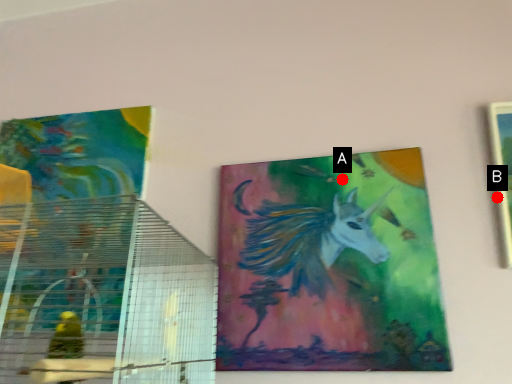
Question: Two points are circled on the image, labeled by A and B beside each circle. Which point is closer to the camera?

Choices:
 (A) A is closer
 (B) B is closer

Answer: (B)